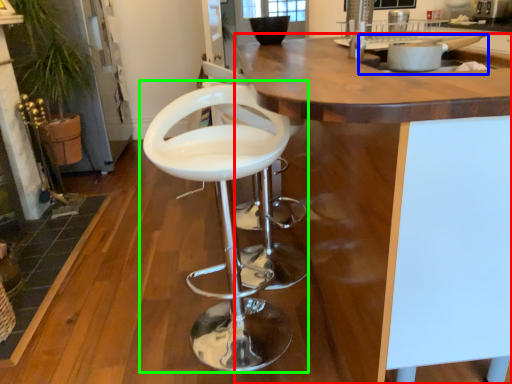
Question: Which is farther away from countertop (highlighted by a red box)? sink (highlighted by a blue box) or chair (highlighted by a green box)?

Choices:
 (A) sink
 (B) chair

Answer: (B)